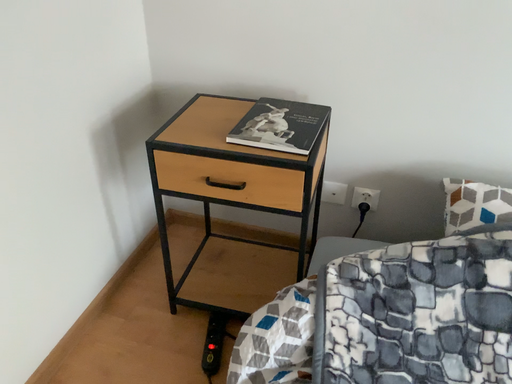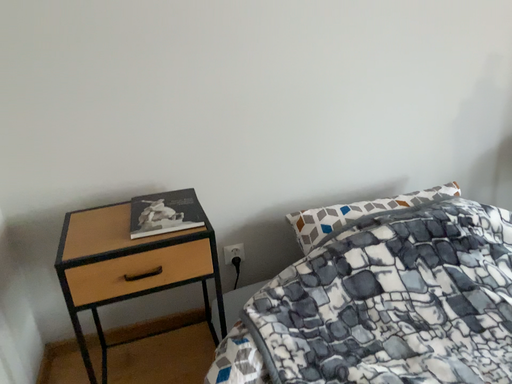
Question: How did the camera likely rotate when shooting the video?

Choices:
 (A) rotated right
 (B) rotated left

Answer: (A)